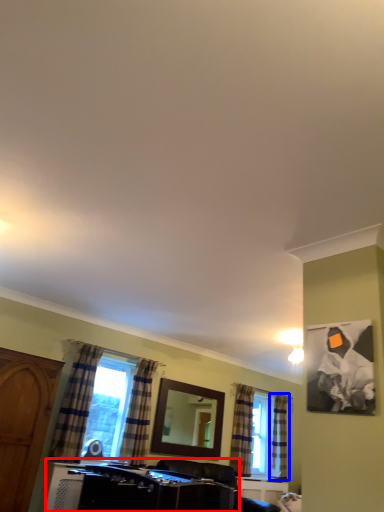
Question: Which of the following is the farthest to the observer, vanity (highlighted by a red box) or curtain (highlighted by a blue box)?

Choices:
 (A) vanity
 (B) curtain

Answer: (B)